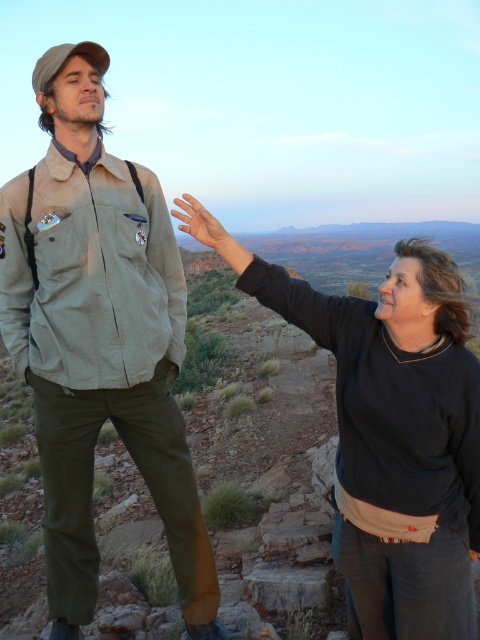
Does black matte sweater at upper right appear over matte skin hand at center?

Incorrect, black matte sweater at upper right is not positioned above matte skin hand at center.

Between point (364, 364) and point (204, 228), which one is positioned in front?

Positioned in front is point (364, 364).

Between point (352, 554) and point (176, 204), which one is positioned behind?

Point (176, 204)

In order to click on black matte sweater at upper right in this screenshot , I will do `click(397, 435)`.

Is point (311, 300) positioned behind point (180, 227)?

No, (311, 300) is closer to viewer.

Is black matte arm at upper center taller than matte skin hand at center?

Yes.

Is point (264, 296) in front of point (196, 234)?

That is True.

You are a GUI agent. You are given a task and a screenshot of the screen. Output one action in this format:
    pyautogui.click(x=<x>, y=<y>)
    Task: Click on the black matte arm at upper center
    The image size is (480, 640).
    Given the screenshot: What is the action you would take?
    pyautogui.click(x=264, y=276)

Does point (350, 388) come behind point (330, 346)?

No, (350, 388) is in front of (330, 346).

Between black matte sweater at upper right and black matte arm at upper center, which one appears on the left side from the viewer's perspective?

From the viewer's perspective, black matte arm at upper center appears more on the left side.

Find the location of `black matte sweater at upper right`. black matte sweater at upper right is located at coordinates (397, 435).

Image resolution: width=480 pixels, height=640 pixels. I want to click on black matte sweater at upper right, so click(397, 435).